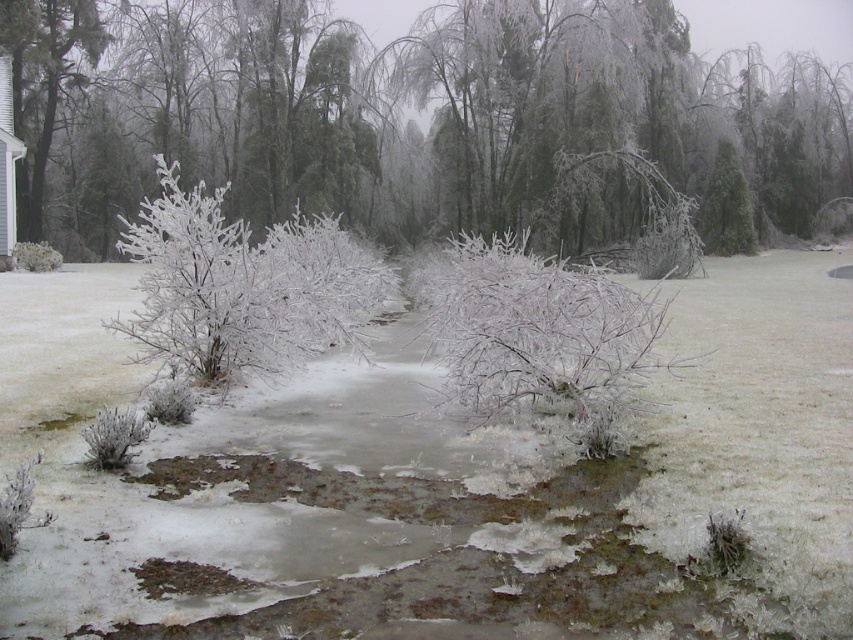
Question: Among these objects, which one is farthest from the camera?

Choices:
 (A) frosted white bush at center
 (B) white frosty bush at lower left
 (C) frosted white bush at upper right
 (D) frosted branches at center

Answer: (C)

Question: Among these points, which one is nearest to the camera?

Choices:
 (A) (54, 252)
 (B) (343, 26)
 (C) (712, 195)
 (D) (283, 256)

Answer: (D)

Question: Is frosted branches at center smaller than white frosty bush at lower left?

Choices:
 (A) no
 (B) yes

Answer: (A)

Question: Considering the relative positions of frosted branches at center and frosted white bush at upper right in the image provided, where is frosted branches at center located with respect to frosted white bush at upper right?

Choices:
 (A) left
 (B) right

Answer: (A)

Question: Which point is farther from the camera taking this photo?

Choices:
 (A) (770, 108)
 (B) (28, 260)
 (C) (741, 248)

Answer: (A)

Question: In this image, where is frosted white bush at upper right located relative to white frosty bush at lower left?

Choices:
 (A) left
 (B) right

Answer: (B)